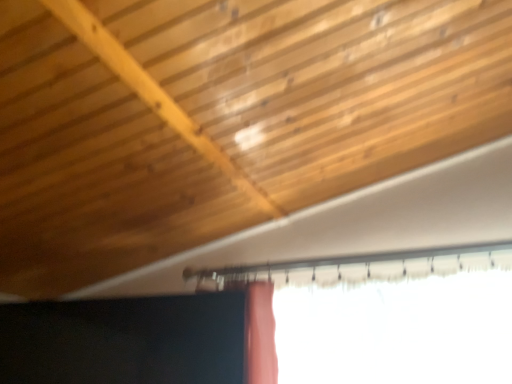
Find the location of a particular element. velvet dark curtain at lower left is located at coordinates (142, 340).

The image size is (512, 384). Describe the element at coordinates (142, 340) in the screenshot. I see `velvet dark curtain at lower left` at that location.

Locate an element on the screen. The height and width of the screenshot is (384, 512). velvet dark curtain at lower left is located at coordinates (142, 340).